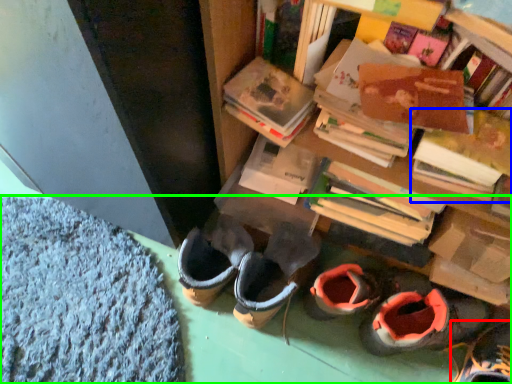
Question: Which object is positioned farthest from footwear (highlighted by a red box)? Select from book (highlighted by a blue box) and carpets (highlighted by a green box).

Choices:
 (A) book
 (B) carpets

Answer: (B)